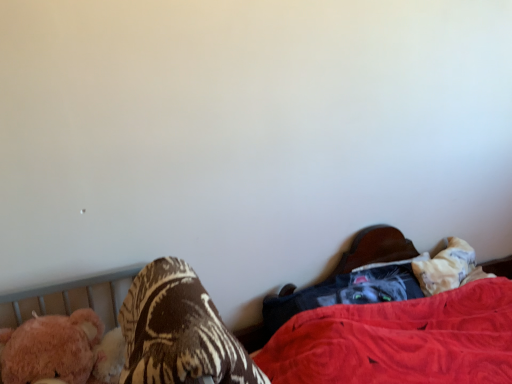
Question: Is the position of velvet black cat at lower right more distant than that of brown textured blanket at lower left?

Choices:
 (A) yes
 (B) no

Answer: (A)

Question: From a real-world perspective, is velvet black cat at lower right beneath brown textured blanket at lower left?

Choices:
 (A) yes
 (B) no

Answer: (A)

Question: From the image's perspective, would you say velvet black cat at lower right is shown under brown textured blanket at lower left?

Choices:
 (A) yes
 (B) no

Answer: (A)

Question: Would you say velvet black cat at lower right contains brown textured blanket at lower left?

Choices:
 (A) yes
 (B) no

Answer: (B)

Question: Is velvet black cat at lower right looking in the opposite direction of brown textured blanket at lower left?

Choices:
 (A) no
 (B) yes

Answer: (A)

Question: Would you say velvet black cat at lower right is a long distance from brown textured blanket at lower left?

Choices:
 (A) no
 (B) yes

Answer: (A)

Question: Could you tell me if brown textured blanket at lower left is facing velvet black cat at lower right?

Choices:
 (A) no
 (B) yes

Answer: (A)

Question: Is brown textured blanket at lower left positioned with its back to velvet black cat at lower right?

Choices:
 (A) yes
 (B) no

Answer: (B)

Question: From a real-world perspective, does brown textured blanket at lower left stand above velvet black cat at lower right?

Choices:
 (A) no
 (B) yes

Answer: (B)

Question: Is brown textured blanket at lower left at the right side of velvet black cat at lower right?

Choices:
 (A) no
 (B) yes

Answer: (A)

Question: Can you confirm if brown textured blanket at lower left is positioned to the left of velvet black cat at lower right?

Choices:
 (A) no
 (B) yes

Answer: (B)

Question: Considering the relative sizes of brown textured blanket at lower left and velvet black cat at lower right in the image provided, is brown textured blanket at lower left bigger than velvet black cat at lower right?

Choices:
 (A) yes
 (B) no

Answer: (B)

Question: Is dark gray fabric at lower right positioned with its back to fuzzy pink teddy bear at left?

Choices:
 (A) yes
 (B) no

Answer: (B)